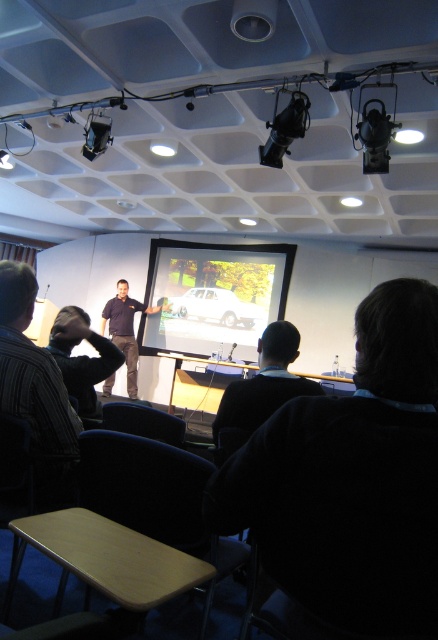
Question: Among these objects, which one is farthest from the camera?

Choices:
 (A) dark brown hair at lower center
 (B) black plastic projector at upper left

Answer: (B)

Question: Is dark brown hair at lower center below black plastic projector at upper left?

Choices:
 (A) yes
 (B) no

Answer: (A)

Question: Considering the real-world distances, which object is farthest from the dark gray shirt at left?

Choices:
 (A) dark brown sweater at center
 (B) dark brown hair at lower center
 (C) matte white screen at center

Answer: (C)

Question: In this image, where is matte white screen at center located relative to dark gray shirt at left?

Choices:
 (A) below
 (B) above

Answer: (B)

Question: Can you confirm if matte black shirt at center is bigger than black plastic projector at upper left?

Choices:
 (A) yes
 (B) no

Answer: (A)

Question: Which of these objects is positioned farthest from the dark gray shirt at left?

Choices:
 (A) black plastic projector at upper left
 (B) dark brown hair at lower center
 (C) dark brown sweater at center
 (D) matte white screen at center

Answer: (D)